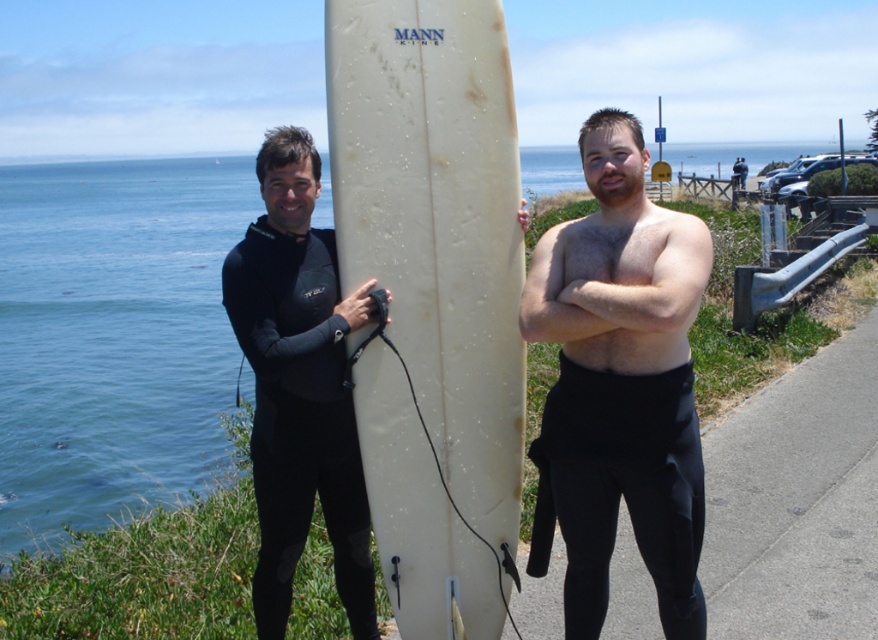
Question: Is shiny black wetsuit at center bigger than black matte wetsuit at left?

Choices:
 (A) no
 (B) yes

Answer: (A)

Question: Which point is farther to the camera?

Choices:
 (A) coord(555,269)
 (B) coord(364,435)
 (C) coord(608,326)

Answer: (B)

Question: Which point is farther from the camera taking this photo?

Choices:
 (A) (655, 272)
 (B) (645, 326)
 (C) (583, 342)

Answer: (C)

Question: Is white matte surfboard at center behind black matte wetsuit at center?

Choices:
 (A) no
 (B) yes

Answer: (B)

Question: Considering the real-world distances, which object is farthest from the white matte surfboard at center?

Choices:
 (A) shiny black wetsuit at center
 (B) black matte wetsuit at left
 (C) black matte wetsuit at center

Answer: (A)

Question: Does shiny black wetsuit at center have a larger size compared to black matte wetsuit at center?

Choices:
 (A) no
 (B) yes

Answer: (B)